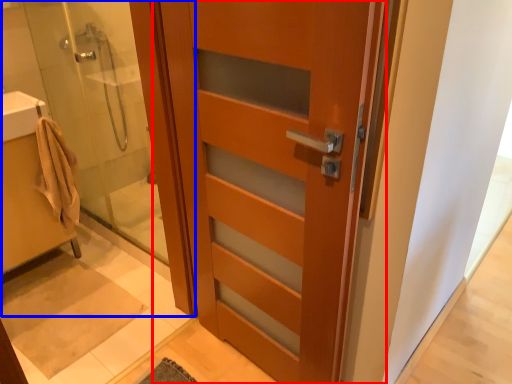
Question: Which point is further to the camera, door (highlighted by a red box) or shower door (highlighted by a blue box)?

Choices:
 (A) door
 (B) shower door

Answer: (B)